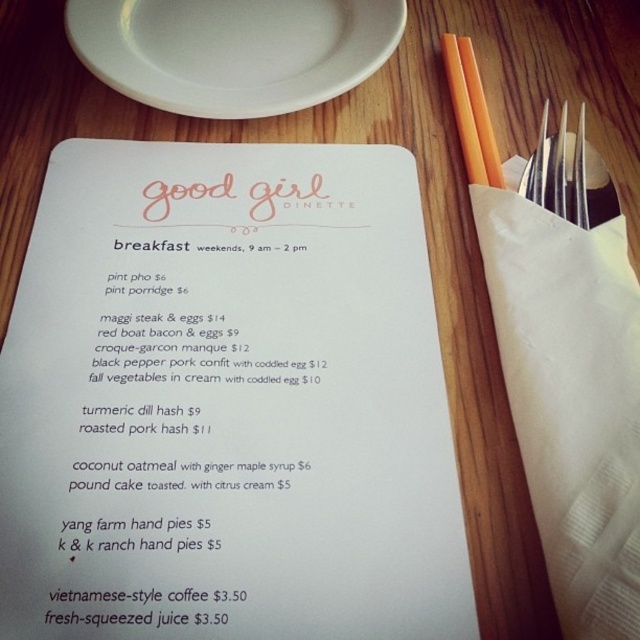
Does white ceramic plate at upper left have a smaller size compared to silver metallic fork at upper right?

No, white ceramic plate at upper left is not smaller than silver metallic fork at upper right.

Between point (173, 100) and point (547, 115), which one is positioned in front?

Point (173, 100) is more forward.

The width and height of the screenshot is (640, 640). Find the location of `white ceramic plate at upper left`. white ceramic plate at upper left is located at coordinates point(234,51).

Is white ceramic plate at upper left in front of orange plastic chopsticks at upper right?

That is False.

Between white ceramic plate at upper left and orange plastic chopsticks at upper right, which one is positioned lower?

Positioned lower is orange plastic chopsticks at upper right.

Locate an element on the screen. white ceramic plate at upper left is located at coordinates (234, 51).

The width and height of the screenshot is (640, 640). In order to click on silver metallic fork at upper right in this screenshot , I will do `click(557, 170)`.

Which is behind, point (577, 145) or point (476, 173)?

The point (476, 173) is more distant.

Locate an element on the screen. silver metallic fork at upper right is located at coordinates tap(557, 170).